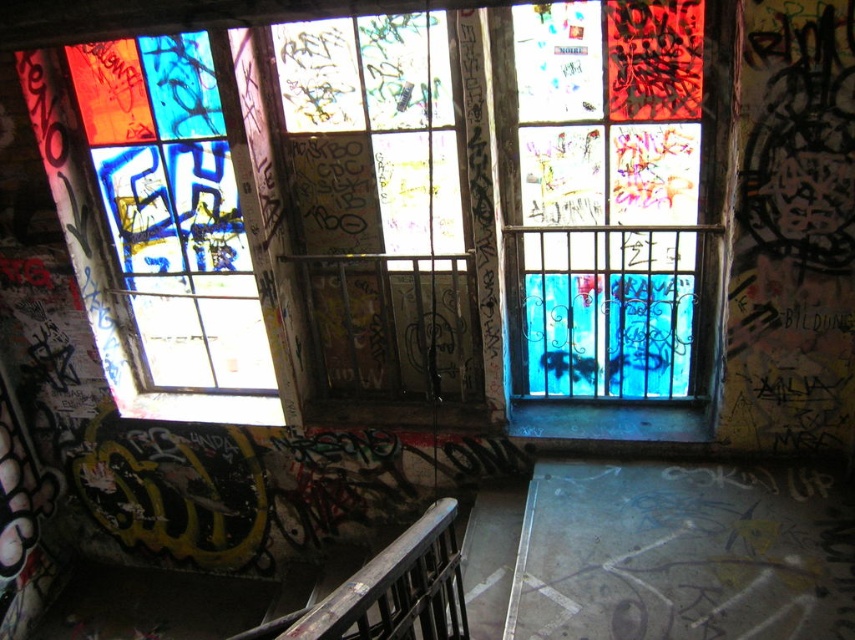
Measure the distance from translucent stained glass at center to dark brown wooden balustrade at center.

translucent stained glass at center and dark brown wooden balustrade at center are 7.97 feet apart.

Consider the image. Is translucent stained glass at center below dark brown wooden balustrade at center?

Actually, translucent stained glass at center is above dark brown wooden balustrade at center.

Measure the distance between translucent stained glass at center and camera.

They are 4.05 meters apart.

Find the location of `translucent stained glass at center`. translucent stained glass at center is located at coordinates (609, 195).

Is stained glass window at upper left taller than dark brown wooden balustrade at center?

Correct, stained glass window at upper left is much taller as dark brown wooden balustrade at center.

Is stained glass window at upper left above dark brown wooden balustrade at center?

Indeed, stained glass window at upper left is positioned over dark brown wooden balustrade at center.

Does point (228, 307) come closer to viewer compared to point (464, 611)?

That is False.

What are the coordinates of `stained glass window at upper left` in the screenshot? It's located at (175, 228).

Between translucent stained glass at center and stained glass window at upper left, which one has more height?

stained glass window at upper left is taller.

Is translucent stained glass at center above stained glass window at upper left?

Yes.

Is point (576, 282) positioned before point (163, 68)?

No.

This screenshot has height=640, width=855. In order to click on translucent stained glass at center in this screenshot , I will do coord(609,195).